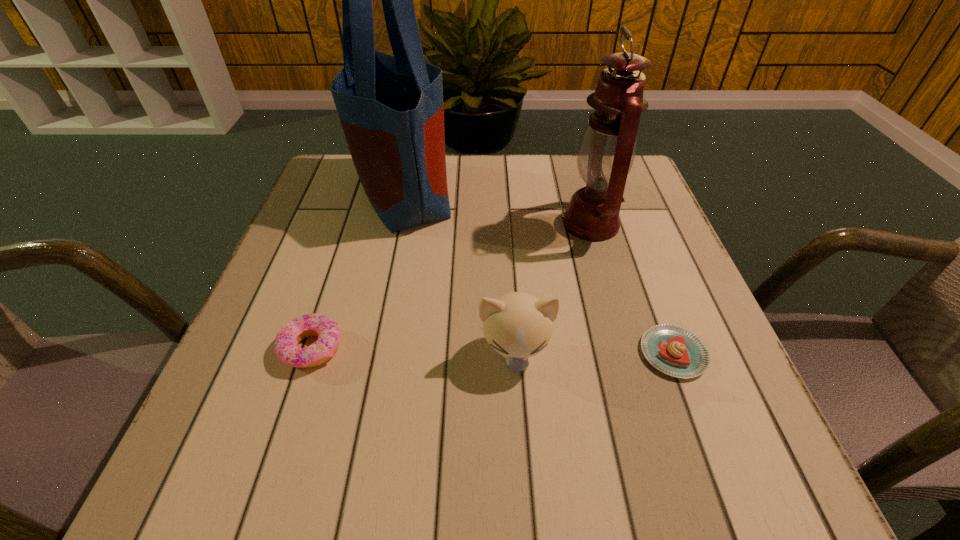
Locate an element on the screen. empty location between the shortest object and the oil lamp is located at coordinates (632, 288).

This screenshot has height=540, width=960. Identify the location of vacant space that's between the third shortest object and the oil lamp. (553, 288).

At what (x,y) coordinates should I click in order to perform the action: click on free space between the handbag and the oil lamp. Please return your answer as a coordinate pair (x, y). Looking at the image, I should click on (497, 208).

The image size is (960, 540). In order to click on free area in between the third tallest object and the oil lamp in this screenshot , I will do `click(553, 288)`.

Where is `object that is the closest to the handbag`? The height and width of the screenshot is (540, 960). object that is the closest to the handbag is located at coordinates (286, 348).

Locate which object ranks second in proximity to the third shortest object. Please provide its 2D coordinates. Your answer should be formatted as a tuple, i.e. [(x, y)], where the tuple contains the x and y coordinates of a point satisfying the conditions above.

[(607, 149)]

Identify the location of free point that satisfies the following two spatial constraints: 1. on the back side of the second shortest object; 2. on the right side of the oil lamp. (352, 224).